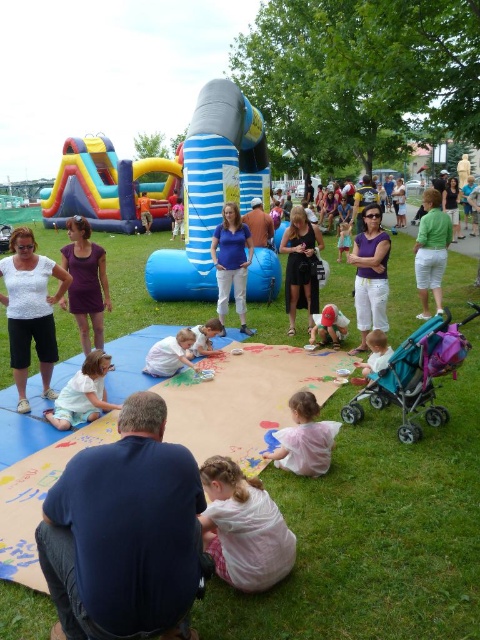
Question: Does matte black dress at center appear over light pink fabric at lower left?

Choices:
 (A) no
 (B) yes

Answer: (B)

Question: Does dark blue shirt at center appear on the right side of light pink fabric at lower right?

Choices:
 (A) no
 (B) yes

Answer: (A)

Question: Which point is farther to the camera?

Choices:
 (A) (168, 365)
 (B) (343, 227)
 (C) (384, 339)

Answer: (B)

Question: Is the position of dark blue shirt at center more distant than that of white matte shirt at center?

Choices:
 (A) no
 (B) yes

Answer: (A)

Question: Estimate the real-world distances between objects in this image. Which object is closer to the red knit cap at center?

Choices:
 (A) light pink fabric at lower left
 (B) green cotton shirt at right

Answer: (B)

Question: Which of the following is the farthest from the observer?

Choices:
 (A) (448, 237)
 (B) (410, 422)
 (C) (342, 230)

Answer: (C)